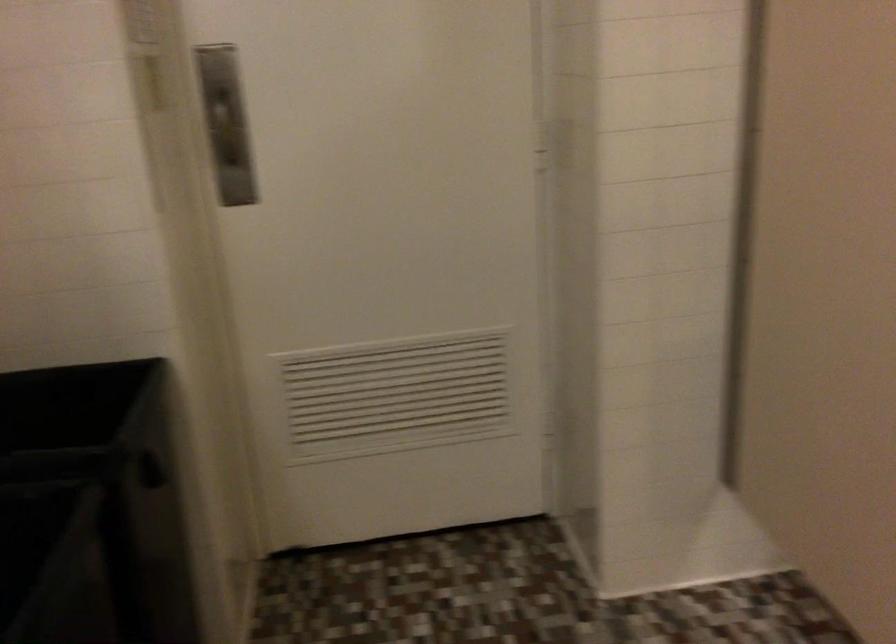
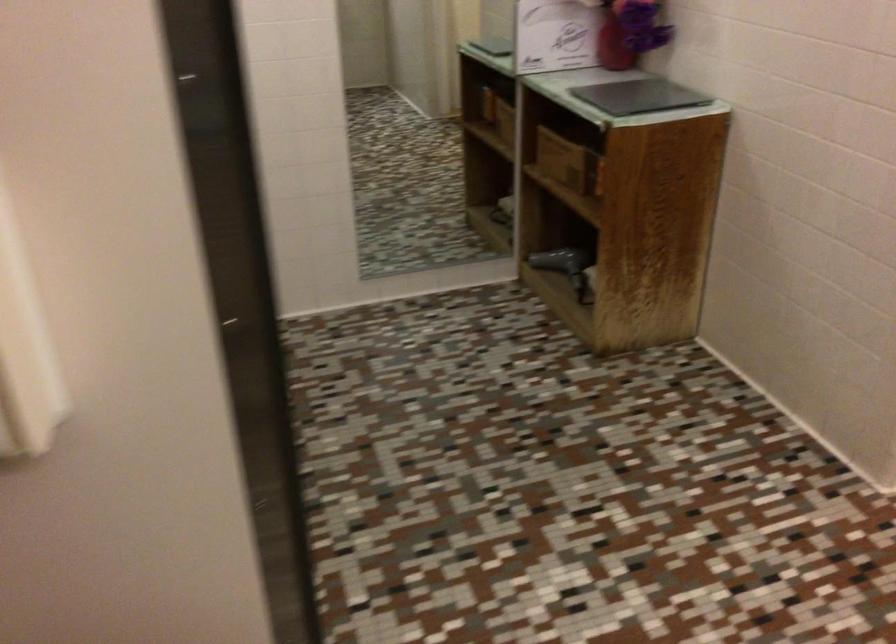
The images are taken continuously from a first-person perspective. In which direction is your viewpoint rotating?

The rotation direction of the camera is right-down.